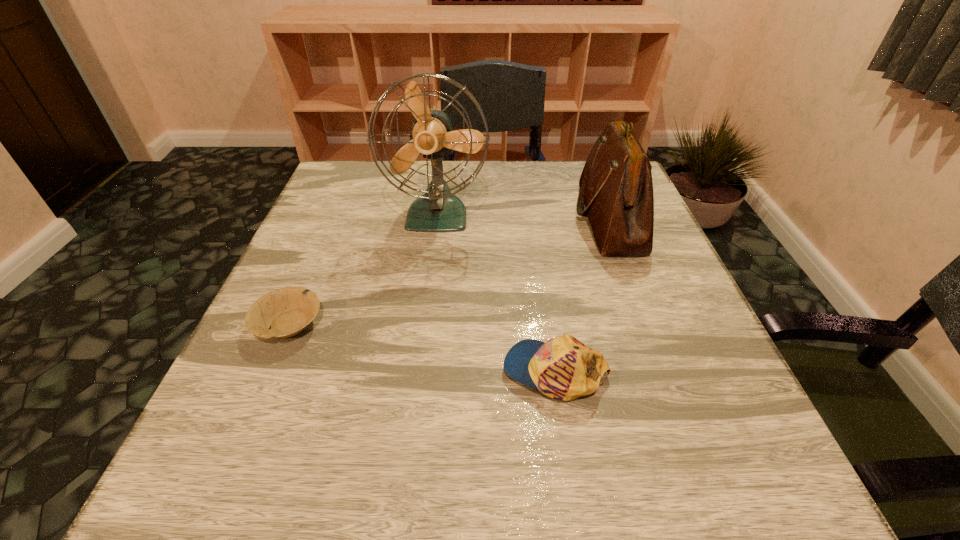
Locate an element on the screen. The image size is (960, 540). vacant space located 0.400m on the bill of the second object from right to left is located at coordinates (255, 371).

You are a GUI agent. You are given a task and a screenshot of the screen. Output one action in this format:
    pyautogui.click(x=<x>, y=<y>)
    Task: Click on the free spot located 0.370m on the bill of the second object from right to left
    The image size is (960, 540).
    Given the screenshot: What is the action you would take?
    pyautogui.click(x=274, y=371)

The height and width of the screenshot is (540, 960). In order to click on free space located on the bill of the second object from right to left in this screenshot , I will do `click(304, 371)`.

This screenshot has width=960, height=540. What are the coordinates of `vacant space situated on the back of the bowl` in the screenshot? It's located at (343, 198).

This screenshot has height=540, width=960. Identify the location of fan that is at the far edge. (438, 210).

This screenshot has width=960, height=540. What are the coordinates of `shoulder bag present at the far edge` in the screenshot? It's located at (616, 187).

Where is `object that is at the left edge`? The image size is (960, 540). object that is at the left edge is located at coordinates (287, 311).

Find the location of a particular element. This screenshot has width=960, height=540. object at the right edge is located at coordinates (616, 187).

At what (x,y) coordinates should I click in order to perform the action: click on object present at the far right corner. Please return your answer as a coordinate pair (x, y). This screenshot has height=540, width=960. Looking at the image, I should click on (616, 187).

You are a GUI agent. You are given a task and a screenshot of the screen. Output one action in this format:
    pyautogui.click(x=<x>, y=<y>)
    Task: Click on the free space at the far edge
    This screenshot has height=540, width=960.
    Given the screenshot: What is the action you would take?
    pyautogui.click(x=568, y=206)